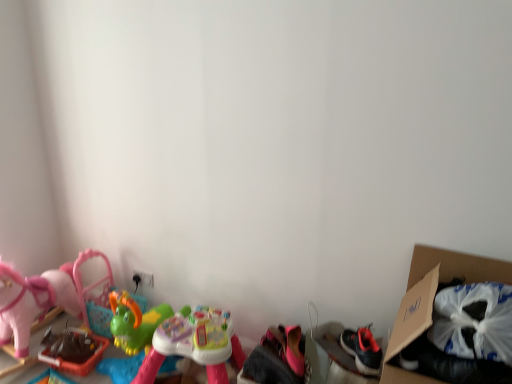
In order to face cardboard box at right, should I rotate leftwards or rightwards?

You should rotate right by 24.976 degrees.

This screenshot has height=384, width=512. What do you see at coordinates (194, 344) in the screenshot?
I see `multicolored plastic toy at center, the second toy in the right-to-left sequence` at bounding box center [194, 344].

The height and width of the screenshot is (384, 512). In order to click on cardboard box at right in this screenshot , I will do `click(456, 266)`.

Is point (284, 333) closer or farther from the camera than point (384, 381)?

Point (284, 333).

From the image's perspective, is pink fabric shoes at lower center, acting as the 1th toy starting from the right, located above or below cardboard box at right?

Based on their image positions, pink fabric shoes at lower center, acting as the 1th toy starting from the right, is located beneath cardboard box at right.

Between pink fabric shoes at lower center, acting as the 1th toy starting from the right, and cardboard box at right, which one appears on the right side from the viewer's perspective?

cardboard box at right.

From their relative heights in the image, would you say pink fabric shoes at lower center, acting as the 1th toy starting from the right, is taller or shorter than cardboard box at right?

Considering their sizes, pink fabric shoes at lower center, acting as the 1th toy starting from the right, has less height than cardboard box at right.

Is the surface of rubberized green toy at lower left, the first toy positioned from the left, in direct contact with cardboard box at right?

They are not placed beside each other.

This screenshot has width=512, height=384. What are the coordinates of `cardboard box in front of the rubberized green toy at lower left, which appears as the third toy when viewed from the right` in the screenshot? It's located at (456, 266).

How different are the orientations of rubberized green toy at lower left, the first toy positioned from the left, and cardboard box at right in degrees?

2.35 degrees.

Between rubberized green toy at lower left, the first toy positioned from the left, and cardboard box at right, which one has smaller width?

Answer: Thinner between the two is rubberized green toy at lower left, the first toy positioned from the left.

Considering the relative sizes of rubberized green toy at lower left, the first toy positioned from the left, and multicolored plastic toy at center, the second toy in the right-to-left sequence, in the image provided, is rubberized green toy at lower left, the first toy positioned from the left, taller than multicolored plastic toy at center, the second toy in the right-to-left sequence,?

Incorrect, the height of rubberized green toy at lower left, the first toy positioned from the left, is not larger of that of multicolored plastic toy at center, the second toy in the right-to-left sequence.

Between rubberized green toy at lower left, the first toy positioned from the left, and multicolored plastic toy at center, the second toy in the right-to-left sequence, which one has larger size?

With larger size is multicolored plastic toy at center, the second toy in the right-to-left sequence.

The height and width of the screenshot is (384, 512). What are the coordinates of `the 1st toy positioned above the rubberized green toy at lower left, which appears as the third toy when viewed from the right (from a real-world perspective)` in the screenshot? It's located at (194, 344).

I want to click on the 1st toy counting from the left of the pink fabric shoes at lower center, arranged as the 3th toy when viewed from the left, so click(x=194, y=344).

How many degrees apart are the facing directions of pink fabric shoes at lower center, acting as the 1th toy starting from the right, and multicolored plastic toy at center, the 2th toy when ordered from left to right?

0.000265 degrees.

From a real-world perspective, relative to multicolored plastic toy at center, the second toy in the right-to-left sequence, is pink fabric shoes at lower center, arranged as the 3th toy when viewed from the left, vertically above or below?

pink fabric shoes at lower center, arranged as the 3th toy when viewed from the left, is situated higher than multicolored plastic toy at center, the second toy in the right-to-left sequence, in the real world.

Considering the sizes of pink fabric shoes at lower center, arranged as the 3th toy when viewed from the left, and multicolored plastic toy at center, the 2th toy when ordered from left to right, in the image, is pink fabric shoes at lower center, arranged as the 3th toy when viewed from the left, wider or thinner than multicolored plastic toy at center, the 2th toy when ordered from left to right,?

pink fabric shoes at lower center, arranged as the 3th toy when viewed from the left, is thinner than multicolored plastic toy at center, the 2th toy when ordered from left to right.

Which is in front, point (419, 382) or point (271, 379)?

The point (419, 382) is in front.

Can you confirm if cardboard box at right is bigger than pink fabric shoes at lower center, arranged as the 3th toy when viewed from the left?

Indeed, cardboard box at right has a larger size compared to pink fabric shoes at lower center, arranged as the 3th toy when viewed from the left.

From the image's perspective, between cardboard box at right and pink fabric shoes at lower center, acting as the 1th toy starting from the right, which one is located above?

cardboard box at right appears higher in the image.

Does cardboard box at right turn towards pink fabric shoes at lower center, arranged as the 3th toy when viewed from the left?

No, cardboard box at right is not turned towards pink fabric shoes at lower center, arranged as the 3th toy when viewed from the left.

Is cardboard box at right oriented away from multicolored plastic toy at center, the 2th toy when ordered from left to right?

No.

Is cardboard box at right positioned beyond the bounds of multicolored plastic toy at center, the 2th toy when ordered from left to right?

cardboard box at right is positioned outside multicolored plastic toy at center, the 2th toy when ordered from left to right.

Does point (462, 268) lie in front of point (231, 355)?

Yes, it is.

Is cardboard box at right bigger or smaller than rubberized green toy at lower left, the first toy positioned from the left?

Clearly, cardboard box at right is larger in size than rubberized green toy at lower left, the first toy positioned from the left.

Is cardboard box at right not close to rubberized green toy at lower left, which appears as the third toy when viewed from the right?

cardboard box at right is far away from rubberized green toy at lower left, which appears as the third toy when viewed from the right.

From the picture: Is the position of cardboard box at right more distant than that of rubberized green toy at lower left, which appears as the third toy when viewed from the right?

No, cardboard box at right is closer to the viewer.

From the image's perspective, is cardboard box at right located above or below rubberized green toy at lower left, which appears as the third toy when viewed from the right?

cardboard box at right is situated higher than rubberized green toy at lower left, which appears as the third toy when viewed from the right, in the image.

Locate an element on the screen. This screenshot has width=512, height=384. the 1st toy to the left of the cardboard box at right, starting your count from the anchor is located at coordinates (277, 357).

Find the location of a particular element. toy that is the 3rd object directly below the cardboard box at right (from a real-world perspective) is located at coordinates (77, 363).

Based on their spatial positions, is rubberized green toy at lower left, which appears as the third toy when viewed from the right, or cardboard box at right further from pink fabric shoes at lower center, arranged as the 3th toy when viewed from the left?

The object further to pink fabric shoes at lower center, arranged as the 3th toy when viewed from the left, is rubberized green toy at lower left, which appears as the third toy when viewed from the right.

Based on their spatial positions, is pink fabric shoes at lower center, arranged as the 3th toy when viewed from the left, or cardboard box at right closer to rubberized green toy at lower left, the first toy positioned from the left?

pink fabric shoes at lower center, arranged as the 3th toy when viewed from the left.

Based on the photo, which object lies nearer to the anchor point rubberized green toy at lower left, which appears as the third toy when viewed from the right, cardboard box at right or pink fabric shoes at lower center, acting as the 1th toy starting from the right?

The object closer to rubberized green toy at lower left, which appears as the third toy when viewed from the right, is pink fabric shoes at lower center, acting as the 1th toy starting from the right.

Estimate the real-world distances between objects in this image. Which object is further from pink fabric shoes at lower center, acting as the 1th toy starting from the right, multicolored plastic toy at center, the 2th toy when ordered from left to right, or cardboard box at right?

cardboard box at right lies further to pink fabric shoes at lower center, acting as the 1th toy starting from the right, than the other object.

When comparing their distances from rubberized green toy at lower left, the first toy positioned from the left, does pink fabric shoes at lower center, arranged as the 3th toy when viewed from the left, or multicolored plastic toy at center, the second toy in the right-to-left sequence, seem closer?

multicolored plastic toy at center, the second toy in the right-to-left sequence, lies closer to rubberized green toy at lower left, the first toy positioned from the left, than the other object.

Based on their spatial positions, is rubberized green toy at lower left, which appears as the third toy when viewed from the right, or pink fabric shoes at lower center, arranged as the 3th toy when viewed from the left, further from multicolored plastic toy at center, the 2th toy when ordered from left to right?

rubberized green toy at lower left, which appears as the third toy when viewed from the right.

Which object lies nearer to the anchor point cardboard box at right, multicolored plastic toy at center, the 2th toy when ordered from left to right, or pink fabric shoes at lower center, arranged as the 3th toy when viewed from the left?

Based on the image, pink fabric shoes at lower center, arranged as the 3th toy when viewed from the left, appears to be nearer to cardboard box at right.

Which object lies nearer to the anchor point multicolored plastic toy at center, the 2th toy when ordered from left to right, cardboard box at right or rubberized green toy at lower left, which appears as the third toy when viewed from the right?

Among the two, rubberized green toy at lower left, which appears as the third toy when viewed from the right, is located nearer to multicolored plastic toy at center, the 2th toy when ordered from left to right.

Where is `toy between multicolored plastic toy at center, the second toy in the right-to-left sequence, and cardboard box at right from left to right`? The width and height of the screenshot is (512, 384). toy between multicolored plastic toy at center, the second toy in the right-to-left sequence, and cardboard box at right from left to right is located at coordinates pos(277,357).

In order to click on toy located between rubberized green toy at lower left, the first toy positioned from the left, and pink fabric shoes at lower center, arranged as the 3th toy when viewed from the left, in the left-right direction in this screenshot , I will do [x=194, y=344].